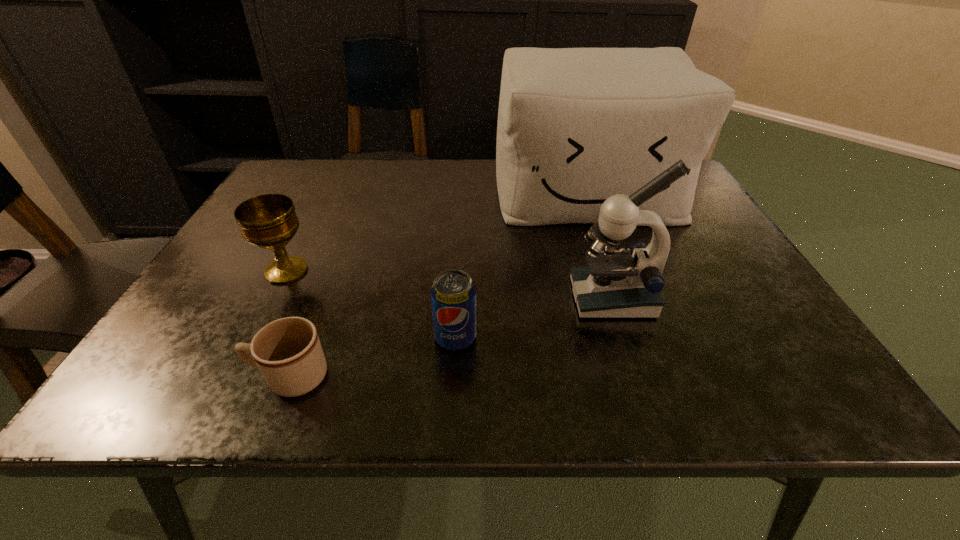
You are a GUI agent. You are given a task and a screenshot of the screen. Output one action in this format:
    pyautogui.click(x=<x>, y=<y>)
    Task: Click on the free spot between the chalice and the tallest object
    This screenshot has height=540, width=960.
    Given the screenshot: What is the action you would take?
    pyautogui.click(x=437, y=231)

What are the coordinates of `vacant space that is in between the farthest object and the chalice` in the screenshot? It's located at (437, 231).

Where is `vacant space in between the second nearest object and the mug`? vacant space in between the second nearest object and the mug is located at coordinates (372, 357).

Locate an element on the screen. The height and width of the screenshot is (540, 960). free space between the second shortest object and the cushion is located at coordinates (521, 265).

At what (x,y) coordinates should I click in order to perform the action: click on the third closest object to the second tallest object. Please return your answer as a coordinate pair (x, y). Image resolution: width=960 pixels, height=540 pixels. Looking at the image, I should click on (288, 352).

You are a GUI agent. You are given a task and a screenshot of the screen. Output one action in this format:
    pyautogui.click(x=<x>, y=<y>)
    Task: Click on the object that can be found as the second closest to the nearest object
    The height and width of the screenshot is (540, 960).
    Given the screenshot: What is the action you would take?
    pyautogui.click(x=269, y=221)

At what (x,y) coordinates should I click in order to perform the action: click on vacant position in the image that satisfies the following two spatial constraints: 1. on the side of the nearest object with the handle; 2. on the back side of the third object from right to left. Please return your answer as a coordinate pair (x, y). Looking at the image, I should click on (305, 337).

The image size is (960, 540). I want to click on free location that satisfies the following two spatial constraints: 1. on the side of the tallest object with the smiley face; 2. at the eyepiece of the microscope, so click(625, 298).

Identify the location of vacant space that satisfies the following two spatial constraints: 1. on the side of the shortest object with the handle; 2. on the back side of the second nearest object. The image size is (960, 540). (305, 337).

Where is `vacant area that satisfies the following two spatial constraints: 1. on the front side of the chalice; 2. on the left side of the third object from left to right`? vacant area that satisfies the following two spatial constraints: 1. on the front side of the chalice; 2. on the left side of the third object from left to right is located at coordinates (252, 337).